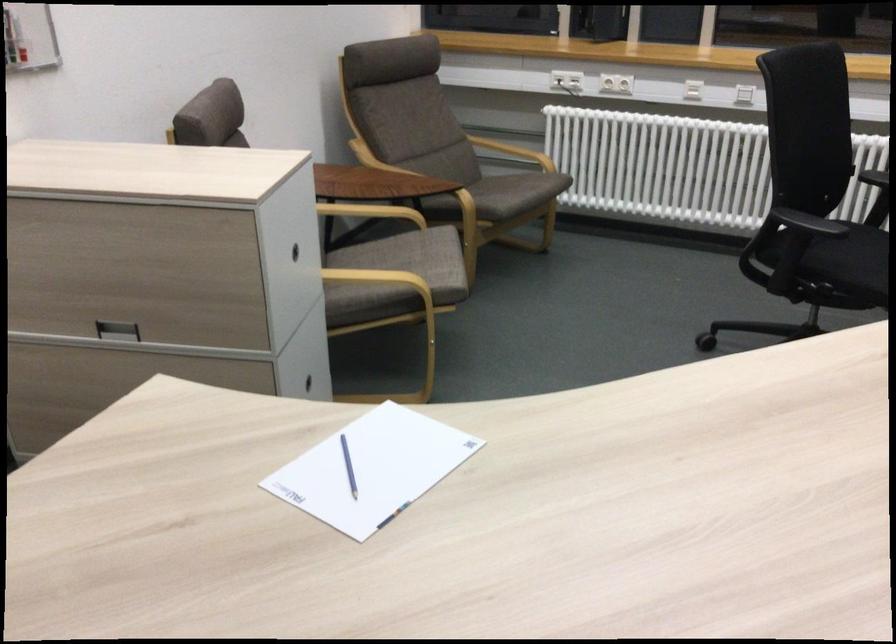
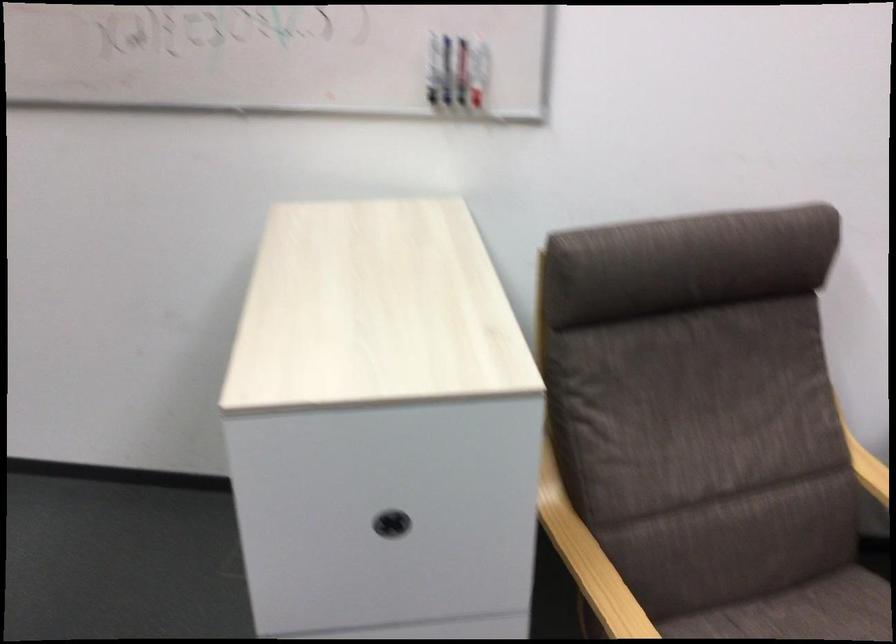
Where in the second image is the point corresponding to point 351,267 from the first image?

(800, 612)